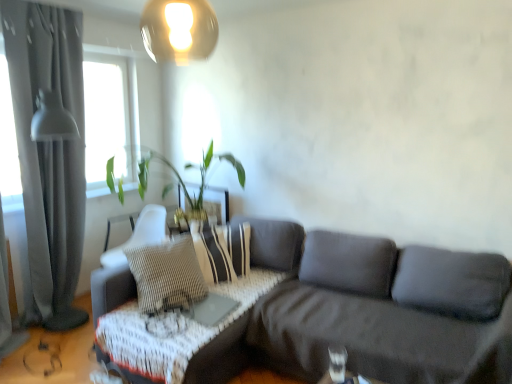
Question: Does point (230, 279) appear closer or farther from the camera than point (121, 281)?

Choices:
 (A) farther
 (B) closer

Answer: (A)

Question: Considering the positions of striped fabric pillow at center and dark gray fabric couch at center in the image, is striped fabric pillow at center bigger or smaller than dark gray fabric couch at center?

Choices:
 (A) small
 (B) big

Answer: (A)

Question: Which object is the closest to the striped fabric pillow at center?

Choices:
 (A) woven fabric armchair at center
 (B) green leafy plant at upper left
 (C) gray fabric curtain at left
 (D) wooden textured table at lower center, the second table in the left-to-right sequence
 (E) woven fabric table at center, the first table viewed from the back

Answer: (E)

Question: Which object is the closest to the gold metallic lampshade at upper center?

Choices:
 (A) gray fabric curtain at left
 (B) matte black table lamp at lower right
 (C) woven fabric armchair at center
 (D) green leafy plant at upper left
 (E) striped fabric pillow at center

Answer: (D)